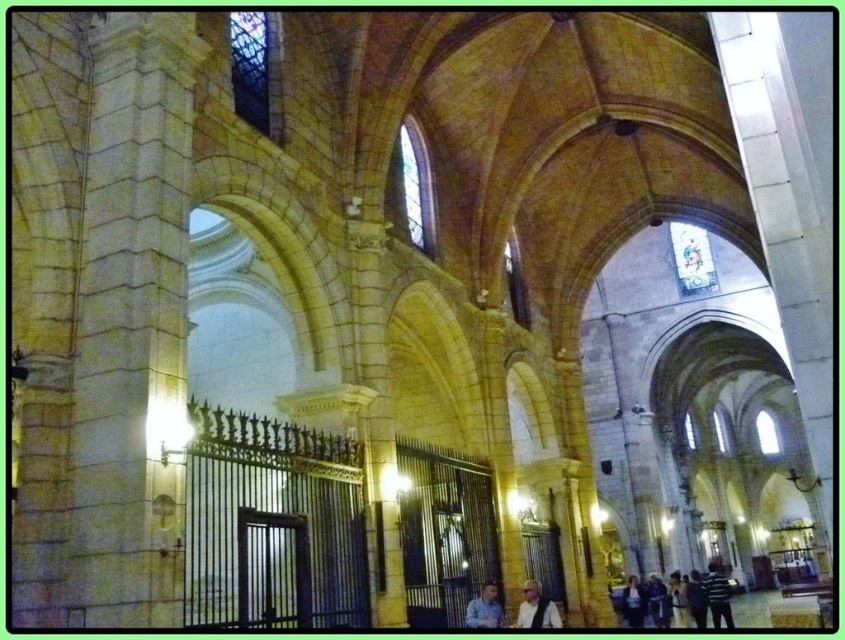
Is blue shirt at center in front of dark blue shirt at lower right?

Yes, it is in front of dark blue shirt at lower right.

The height and width of the screenshot is (640, 845). Describe the element at coordinates (484, 609) in the screenshot. I see `blue shirt at center` at that location.

At what (x,y) coordinates should I click in order to perform the action: click on blue shirt at center. Please return your answer as a coordinate pair (x, y). The width and height of the screenshot is (845, 640). Looking at the image, I should click on (484, 609).

Measure the distance between light brown leather jacket at lower center and blue shirt at center.

The distance of light brown leather jacket at lower center from blue shirt at center is 11.11 feet.

Does point (533, 596) come in front of point (500, 608)?

Yes, point (533, 596) is in front of point (500, 608).

Who is more forward, (548, 624) or (493, 589)?

Point (548, 624) is more forward.

Identify the location of light brown leather jacket at lower center. (537, 609).

Can you confirm if light brown leather jacket at lower center is smaller than dark blue jeans at lower right?

Indeed, light brown leather jacket at lower center has a smaller size compared to dark blue jeans at lower right.

Consider the image. Is light brown leather jacket at lower center shorter than dark blue jeans at lower right?

Yes.

Is point (549, 611) positioned in front of point (657, 582)?

Yes, it is.

The image size is (845, 640). What are the coordinates of `light brown leather jacket at lower center` in the screenshot? It's located at (537, 609).